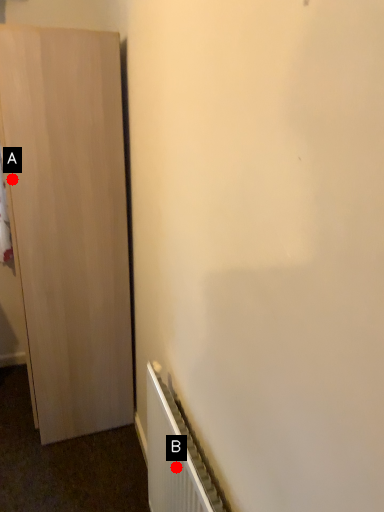
Question: Two points are circled on the image, labeled by A and B beside each circle. Which point is closer to the camera?

Choices:
 (A) A is closer
 (B) B is closer

Answer: (B)